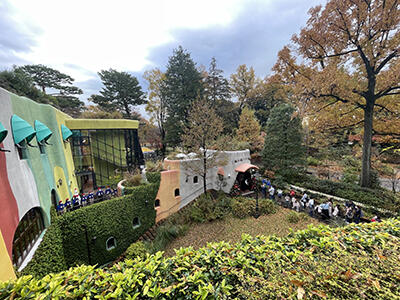
Where is `statue`? The height and width of the screenshot is (300, 400). statue is located at coordinates (145, 173).